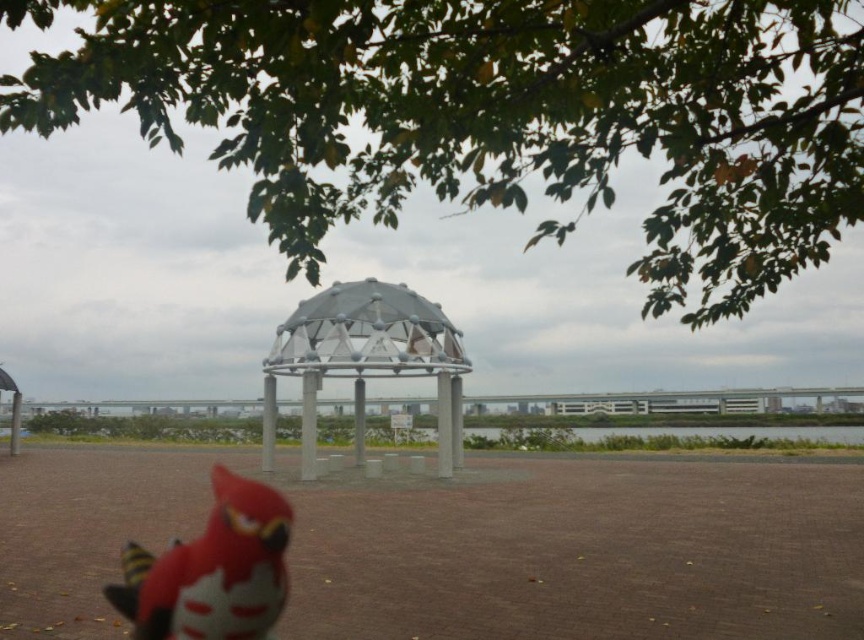
You are standing in the park and want to take a photo of the green leafy tree at upper center. Where should you position yourself to capture it in the frame?

To capture the green leafy tree at upper center in your photo, position yourself so that the tree is centered at the coordinates point [496,115].

You are standing at the point marked by the coordinates point (496,115) in the park scene. Looking towards the green leafy tree at upper center, which direction should you face to have the red parrot with yellow accents in the foreground directly behind you?

To have the red parrot with yellow accents in the foreground directly behind you while facing the green leafy tree at upper center, you should face north. The green leafy tree at upper center is located north of the point (496,115), and the red parrot with yellow accents is positioned to the south of this point.